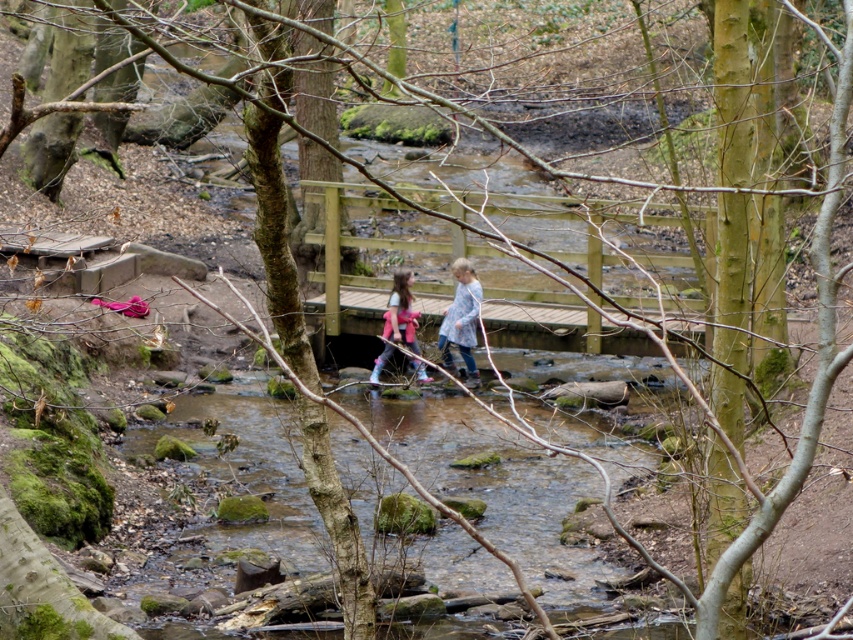
You are a hiker who wants to know if your backpack can fit through a narrow gap between two trees on the bridge. Given that the gap is 0.5 meters wide, and you have the plaid fabric shirt at center and the pink fabric backpack at center, which item is more likely to fit through the gap?

The plaid fabric shirt at center is smaller than the pink fabric backpack at center, so the plaid fabric shirt at center is more likely to fit through the 0.5 meters wide gap.

You are a hiker trying to cross the wooden bridge over the stream. You notice a plaid fabric shirt at center and a pink fabric backpack at center. Which item is closer to you as you walk towards the bridge?

The plaid fabric shirt at center is closer to you because the pink fabric backpack at center is behind it.